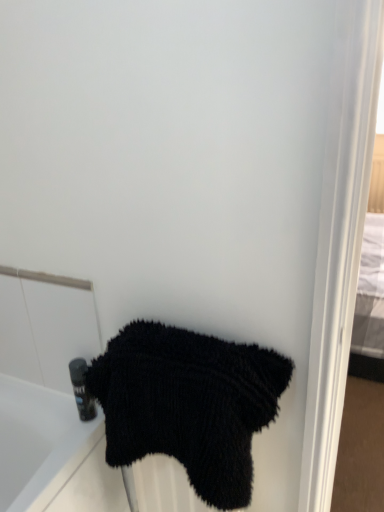
Find the location of a particular element. black fuzzy towel at lower center is located at coordinates (188, 404).

The image size is (384, 512). What do you see at coordinates (188, 404) in the screenshot?
I see `black fuzzy towel at lower center` at bounding box center [188, 404].

At what (x,y) coordinates should I click in order to perform the action: click on black fuzzy towel at lower center. Please return your answer as a coordinate pair (x, y). This screenshot has height=512, width=384. Looking at the image, I should click on (188, 404).